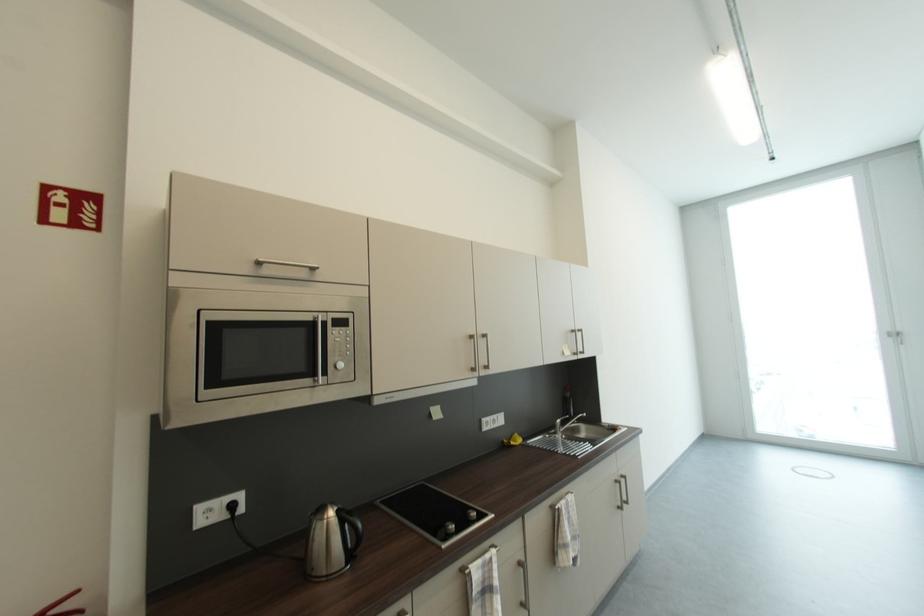
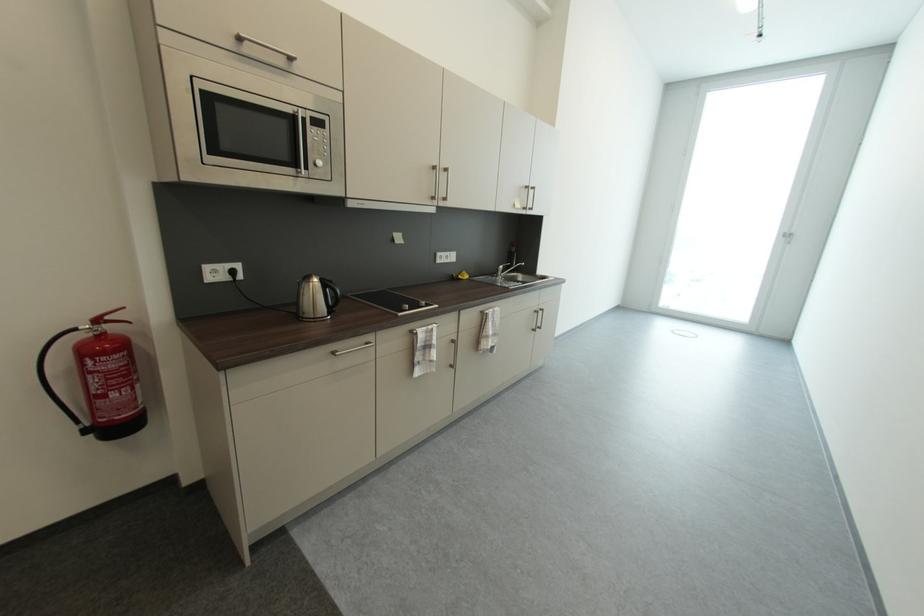
Find the pixel in the second image that matches (x=623, y=484) in the first image.

(541, 313)